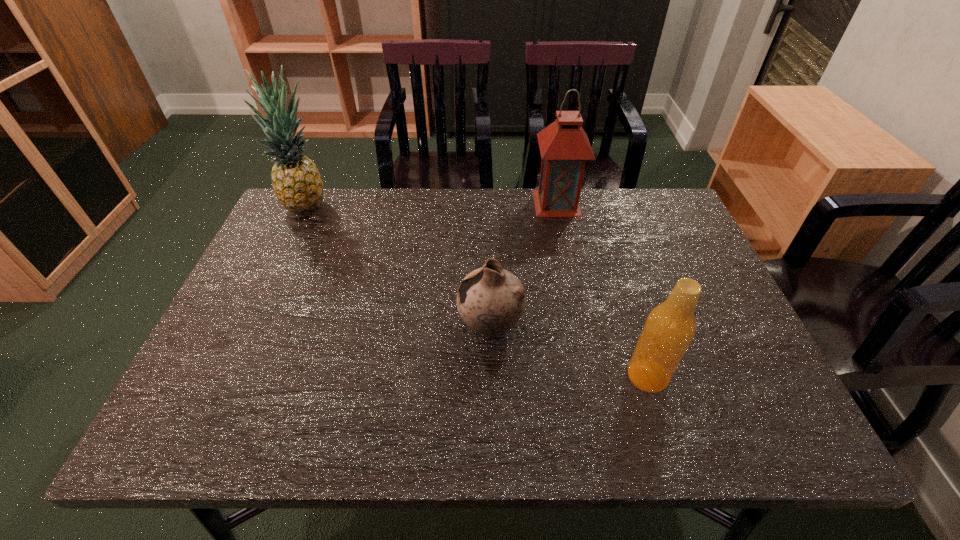
The image size is (960, 540). I want to click on vacant space at the near right corner of the desktop, so click(x=774, y=416).

This screenshot has height=540, width=960. Find the location of `blank region between the third object from right to left and the pineapple`. blank region between the third object from right to left and the pineapple is located at coordinates (398, 266).

This screenshot has height=540, width=960. Find the location of `free space between the leftmost object and the second object from left to right`. free space between the leftmost object and the second object from left to right is located at coordinates (398, 266).

Where is `vacant point located between the lantern and the pineapple`? Image resolution: width=960 pixels, height=540 pixels. vacant point located between the lantern and the pineapple is located at coordinates (432, 204).

At what (x,y) coordinates should I click in order to perform the action: click on vacant point located between the lantern and the beer bottle. Please return your answer as a coordinate pair (x, y). Image resolution: width=960 pixels, height=540 pixels. Looking at the image, I should click on (602, 289).

Identify the location of vacant area that lies between the third farthest object and the lantern. (524, 265).

Image resolution: width=960 pixels, height=540 pixels. What are the coordinates of `free area in between the third tallest object and the lantern` in the screenshot? It's located at (602, 289).

Find the location of `free space that is in between the nearest object and the third object from right to left`. free space that is in between the nearest object and the third object from right to left is located at coordinates (569, 351).

The height and width of the screenshot is (540, 960). Identify the location of free spot between the third farthest object and the nearest object. 569,351.

Identify which object is located as the nearest to the lantern. Please provide its 2D coordinates. Your answer should be formatted as a tuple, i.e. [(x, y)], where the tuple contains the x and y coordinates of a point satisfying the conditions above.

[(491, 300)]